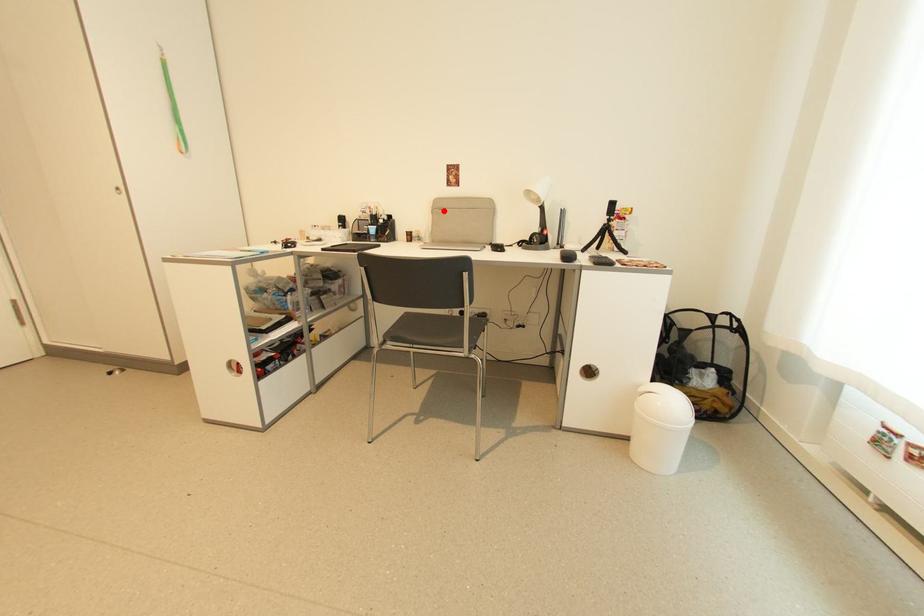
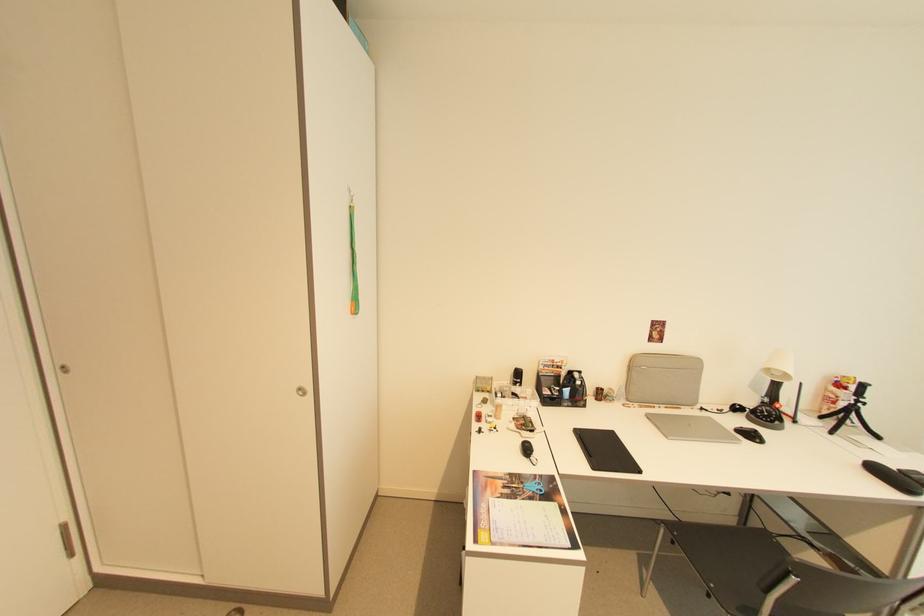
In the second image, find the point that corresponds to the highlighted location in the first image.

(638, 366)